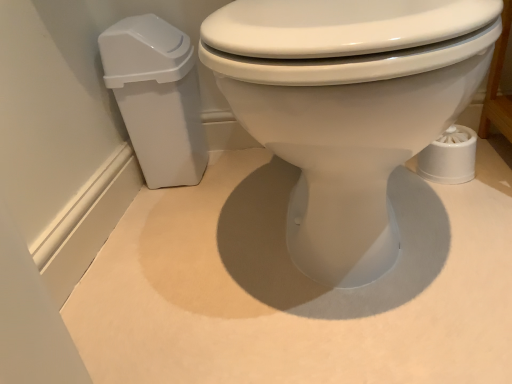
Question: Is white glossy toilet at center outside of white plastic trash can at left?

Choices:
 (A) yes
 (B) no

Answer: (A)

Question: Is white glossy toilet at center bigger than white plastic trash can at left?

Choices:
 (A) yes
 (B) no

Answer: (A)

Question: Is white glossy toilet at center next to white plastic trash can at left and touching it?

Choices:
 (A) yes
 (B) no

Answer: (B)

Question: From a real-world perspective, is white glossy toilet at center located beneath white plastic trash can at left?

Choices:
 (A) yes
 (B) no

Answer: (B)

Question: Is white glossy toilet at center positioned with its back to white plastic trash can at left?

Choices:
 (A) yes
 (B) no

Answer: (B)

Question: Considering the relative positions of white glossy toilet at center and white plastic trash can at left in the image provided, is white glossy toilet at center to the left of white plastic trash can at left from the viewer's perspective?

Choices:
 (A) yes
 (B) no

Answer: (B)

Question: Can you confirm if white plastic trash can at left is thinner than white glossy toilet at center?

Choices:
 (A) no
 (B) yes

Answer: (B)

Question: Is white plastic trash can at left behind white glossy toilet at center?

Choices:
 (A) yes
 (B) no

Answer: (A)

Question: Considering the relative sizes of white plastic trash can at left and white glossy toilet at center in the image provided, is white plastic trash can at left shorter than white glossy toilet at center?

Choices:
 (A) yes
 (B) no

Answer: (A)

Question: Is white plastic trash can at left not close to white glossy toilet at center?

Choices:
 (A) yes
 (B) no

Answer: (B)

Question: Is white plastic trash can at left smaller than white glossy toilet at center?

Choices:
 (A) no
 (B) yes

Answer: (B)

Question: Does white plastic trash can at left appear on the right side of white glossy toilet at center?

Choices:
 (A) no
 (B) yes

Answer: (A)

Question: Would you say white glossy toilet at center is inside or outside white plastic trash can at left?

Choices:
 (A) outside
 (B) inside

Answer: (A)